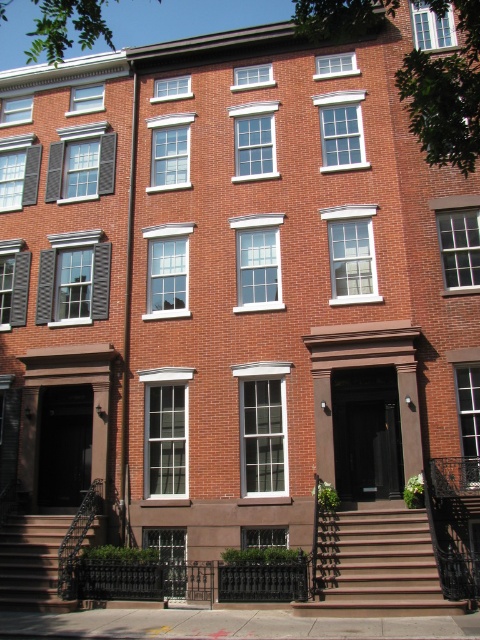
Question: Can you confirm if brown wooden stairs at center is positioned to the left of brown wooden stairs at lower left?

Choices:
 (A) no
 (B) yes

Answer: (A)

Question: In this image, where is brown wooden stairs at center located relative to brown wooden stairs at lower left?

Choices:
 (A) right
 (B) left

Answer: (A)

Question: Which point is closer to the camera?

Choices:
 (A) (69, 600)
 (B) (330, 593)

Answer: (B)

Question: Among these objects, which one is farthest from the camera?

Choices:
 (A) brown wooden stairs at center
 (B) brown wooden stairs at lower left

Answer: (B)

Question: Does brown wooden stairs at center appear under brown wooden stairs at lower left?

Choices:
 (A) yes
 (B) no

Answer: (B)